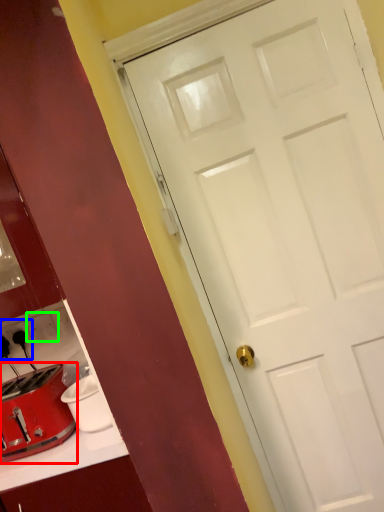
Question: Which is farther away from toaster (highlighted by a red box)? electric outlet (highlighted by a blue box) or electric outlet (highlighted by a green box)?

Choices:
 (A) electric outlet
 (B) electric outlet

Answer: (A)